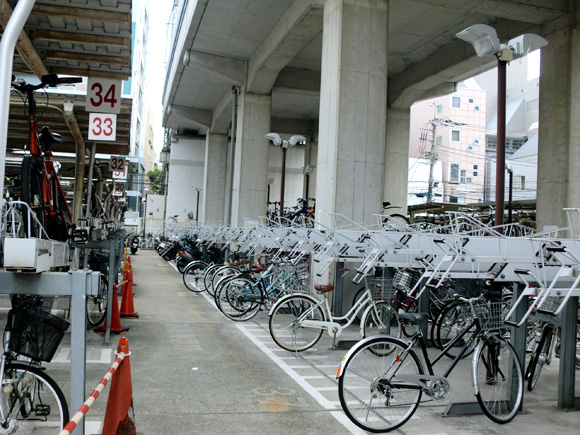
The width and height of the screenshot is (580, 435). I want to click on pillar, so click(364, 203).